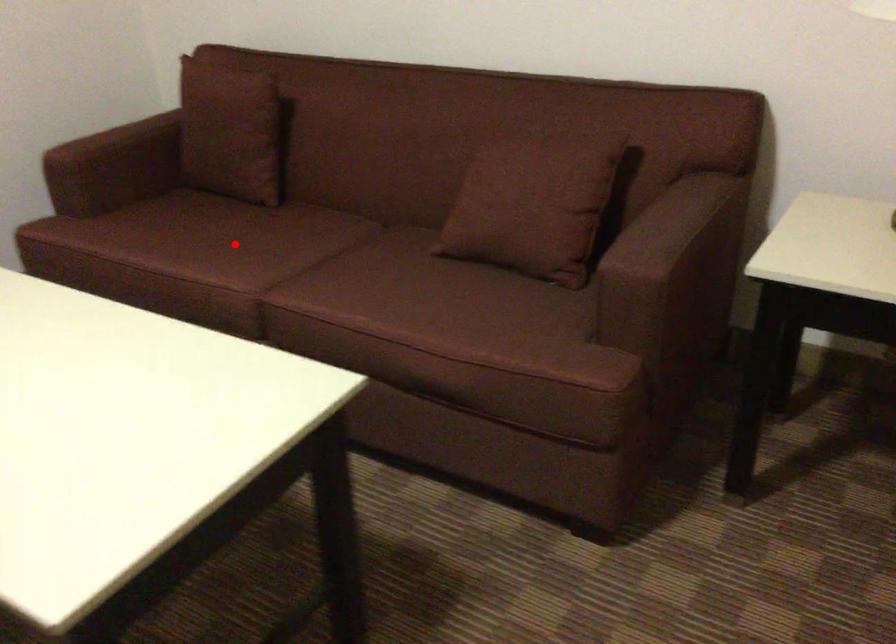
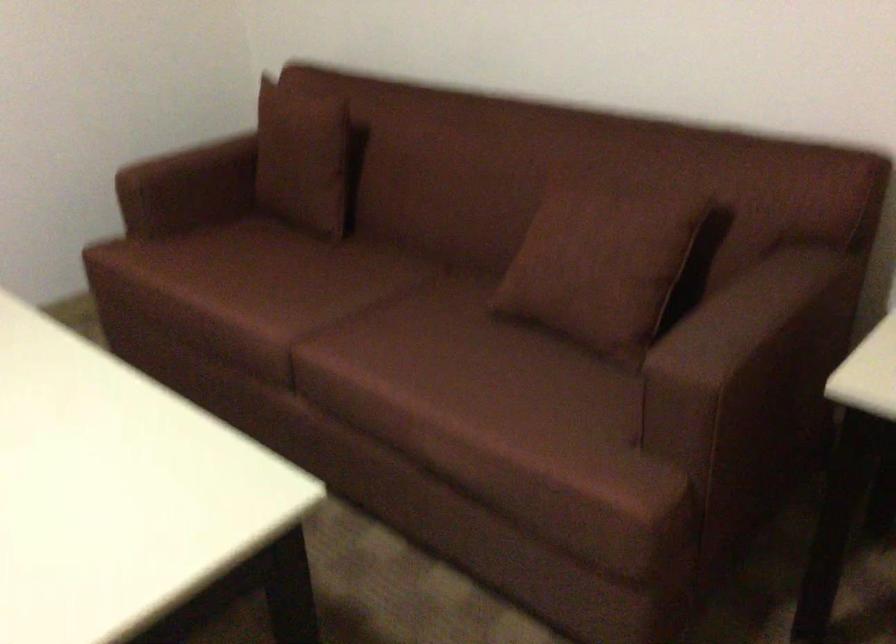
Where in the second image is the point corresponding to the highlighted location from the first image?

(286, 283)